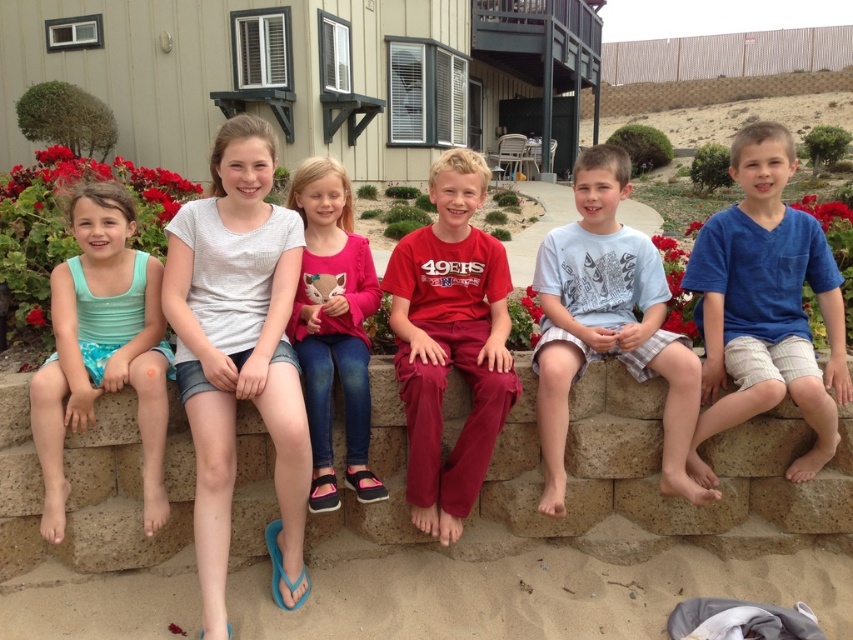
You are a photographer trying to capture a group photo of the children. You notice the matte teal swimsuit at left and the pink fleece sweater at center. Which clothing item takes up more horizontal space in the photo?

The matte teal swimsuit at left takes up more horizontal space in the photo because its width is larger than that of the pink fleece sweater at center.

You are a photographer trying to capture a candid shot of the children sitting on the stone wall. You notice the blue cotton shirt at center and the pink fleece sweater at center. Which clothing item is positioned higher in the frame?

The blue cotton shirt at center is taller than the pink fleece sweater at center, so the blue cotton shirt at center is positioned higher in the frame.